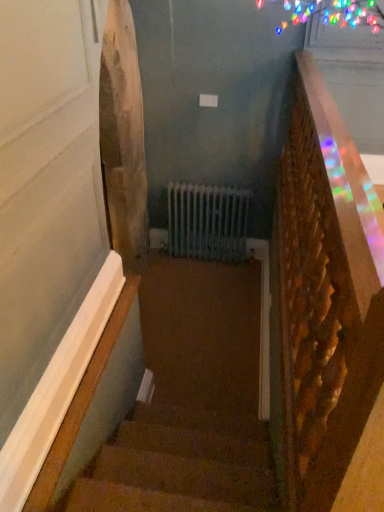
What is the approximate width of carpeted stairs at center?

It is 8.75 feet.

Describe the element at coordinates (190, 402) in the screenshot. This screenshot has height=512, width=384. I see `carpeted stairs at center` at that location.

The width and height of the screenshot is (384, 512). Identify the location of carpeted stairs at center. (190, 402).

Image resolution: width=384 pixels, height=512 pixels. I want to click on wooden textured rail at right, so click(x=326, y=295).

What is the approximate height of wooden textured rail at right?

wooden textured rail at right is 1.03 meters tall.

Describe the element at coordinates (326, 295) in the screenshot. I see `wooden textured rail at right` at that location.

The image size is (384, 512). I want to click on carpeted stairs at center, so [x=190, y=402].

Based on their positions, is carpeted stairs at center located to the left or right of wooden textured rail at right?

Based on their positions, carpeted stairs at center is located to the left of wooden textured rail at right.

From the picture: In the image, is carpeted stairs at center positioned in front of or behind wooden textured rail at right?

In the image, carpeted stairs at center appears behind wooden textured rail at right.

Which point is more distant from viewer, (142,501) or (356,374)?

The point (142,501) is more distant.

From the image's perspective, is carpeted stairs at center under wooden textured rail at right?

Yes.

From a real-world perspective, is carpeted stairs at center over wooden textured rail at right?

No, from a real-world perspective, carpeted stairs at center is not above wooden textured rail at right.

Can you confirm if carpeted stairs at center is wider than wooden textured rail at right?

Yes, carpeted stairs at center is wider than wooden textured rail at right.

In terms of height, does carpeted stairs at center look taller or shorter compared to wooden textured rail at right?

Considering their sizes, carpeted stairs at center has less height than wooden textured rail at right.

Considering the sizes of carpeted stairs at center and wooden textured rail at right in the image, is carpeted stairs at center bigger or smaller than wooden textured rail at right?

Considering their sizes, carpeted stairs at center takes up less space than wooden textured rail at right.

Consider the image. Which is correct: carpeted stairs at center is inside wooden textured rail at right, or outside of it?

carpeted stairs at center is not inside wooden textured rail at right, it's outside.

Looking at this image, is there a large distance between carpeted stairs at center and wooden textured rail at right?

Yes.

Is wooden textured rail at right at the back of carpeted stairs at center?

carpeted stairs at center is not turned away from wooden textured rail at right.

Consider the image. What's the angular difference between carpeted stairs at center and wooden textured rail at right's facing directions?

90.7 degrees.

Where is `rail that is above the carpeted stairs at center (from a real-world perspective)`? The height and width of the screenshot is (512, 384). rail that is above the carpeted stairs at center (from a real-world perspective) is located at coordinates (326, 295).

Can you confirm if wooden textured rail at right is positioned to the left of carpeted stairs at center?

Incorrect, wooden textured rail at right is not on the left side of carpeted stairs at center.

Based on the photo, in the image, is wooden textured rail at right positioned in front of or behind carpeted stairs at center?

Visually, wooden textured rail at right is located in front of carpeted stairs at center.

Does point (345, 174) come farther from viewer compared to point (88, 466)?

No, it is not.

From the image's perspective, relative to carpeted stairs at center, is wooden textured rail at right above or below?

Clearly, from the image's perspective, wooden textured rail at right is above carpeted stairs at center.

From a real-world perspective, is wooden textured rail at right on carpeted stairs at center?

Yes, from a real-world perspective, wooden textured rail at right is above carpeted stairs at center.

Which of these two, wooden textured rail at right or carpeted stairs at center, is thinner?

wooden textured rail at right.

Which of these two, wooden textured rail at right or carpeted stairs at center, stands shorter?

carpeted stairs at center.

Can you confirm if wooden textured rail at right is bigger than carpeted stairs at center?

Indeed, wooden textured rail at right has a larger size compared to carpeted stairs at center.

Is wooden textured rail at right not within carpeted stairs at center?

Yes.

Are wooden textured rail at right and carpeted stairs at center making contact?

No, wooden textured rail at right is not with carpeted stairs at center.

Could you tell me if wooden textured rail at right is facing carpeted stairs at center?

No, wooden textured rail at right is not facing towards carpeted stairs at center.

Based on the photo, how many degrees apart are the facing directions of wooden textured rail at right and carpeted stairs at center?

There is a 90.7-degree angle between the facing directions of wooden textured rail at right and carpeted stairs at center.

Locate an element on the screen. The width and height of the screenshot is (384, 512). rail that appears above the carpeted stairs at center (from a real-world perspective) is located at coordinates (326, 295).

Identify the location of rail above the carpeted stairs at center (from a real-world perspective). The image size is (384, 512). (326, 295).

Identify the location of stairs lying on the left of wooden textured rail at right. (190, 402).